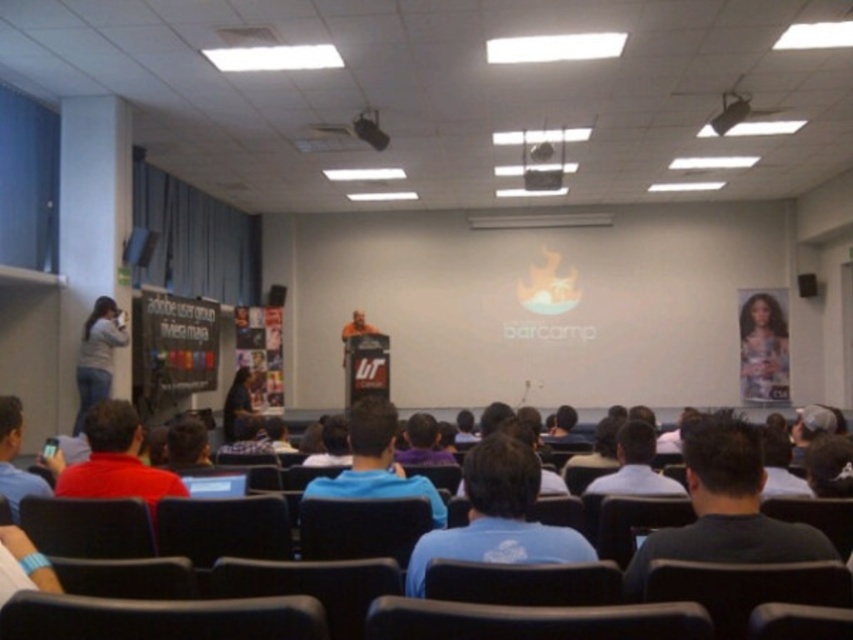
Which is in front, point (77, 492) or point (238, 413)?

Point (77, 492) is more forward.

Between red matte shirt at lower left and checkered shirt at center, which one appears on the left side from the viewer's perspective?

checkered shirt at center is more to the left.

You are a GUI agent. You are given a task and a screenshot of the screen. Output one action in this format:
    pyautogui.click(x=<x>, y=<y>)
    Task: Click on the red matte shirt at lower left
    This screenshot has width=853, height=640.
    Given the screenshot: What is the action you would take?
    pyautogui.click(x=115, y=461)

The width and height of the screenshot is (853, 640). Identify the location of red matte shirt at lower left. pyautogui.click(x=115, y=461).

Describe the element at coordinates (97, 355) in the screenshot. I see `gray cotton shirt at left` at that location.

Is gray cotton shirt at left closer to the viewer compared to checkered shirt at center?

Yes, it is.

This screenshot has height=640, width=853. Describe the element at coordinates (97, 355) in the screenshot. I see `gray cotton shirt at left` at that location.

What are the coordinates of `gray cotton shirt at left` in the screenshot? It's located at (97, 355).

Does red matte shirt at lower left appear over gray cotton shirt at left?

No, red matte shirt at lower left is not above gray cotton shirt at left.

Based on the photo, is red matte shirt at lower left behind gray cotton shirt at left?

That is False.

Is point (160, 493) farther from camera compared to point (97, 346)?

No, (160, 493) is in front of (97, 346).

Find the location of a particular element. red matte shirt at lower left is located at coordinates (115, 461).